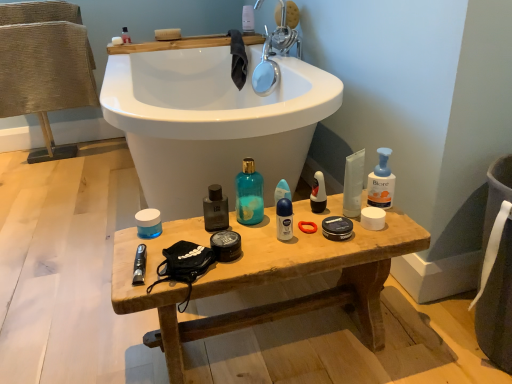
Where is `space that is in front of white matte tube at center right, which is the 2th cleaning product in left-to-right order`? space that is in front of white matte tube at center right, which is the 2th cleaning product in left-to-right order is located at coordinates [x=357, y=238].